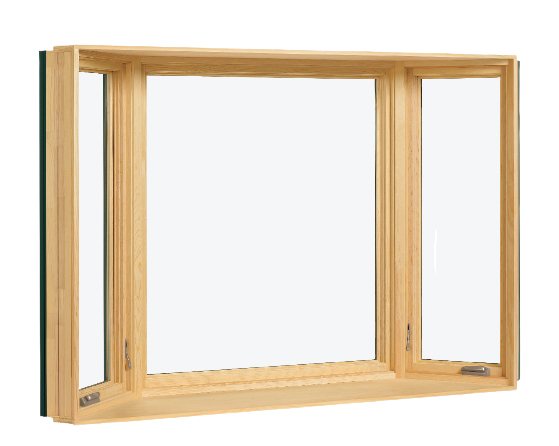
Locate an element on the screen. Image resolution: width=559 pixels, height=446 pixels. hardware on window is located at coordinates (478, 370), (90, 393), (130, 358).